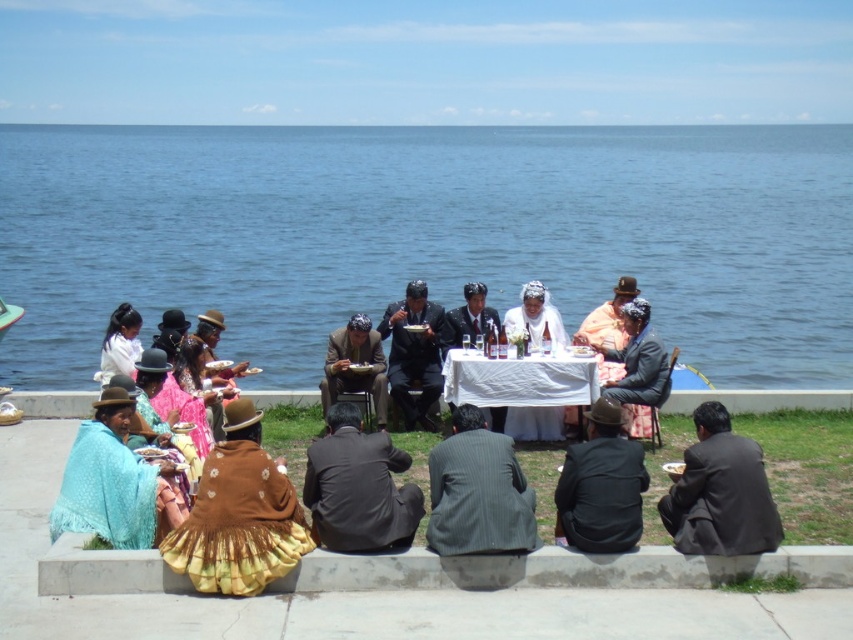
You are at the gathering and want to greet the person in the dark gray suit at center. Which direction should you move relative to the matte orange shirt at center?

You should move to the left of the matte orange shirt at center to reach the dark gray suit at center, as the dark gray suit at center is positioned to the left of the matte orange shirt at center.

You are standing at the camera position and want to reach both point (376, 504) and point (618, 284). Which point should you go to first to minimize the total distance traveled?

You should go to point (376, 504) first because it is closer to the camera than point (618, 284), so reaching it first would minimize the total distance traveled.